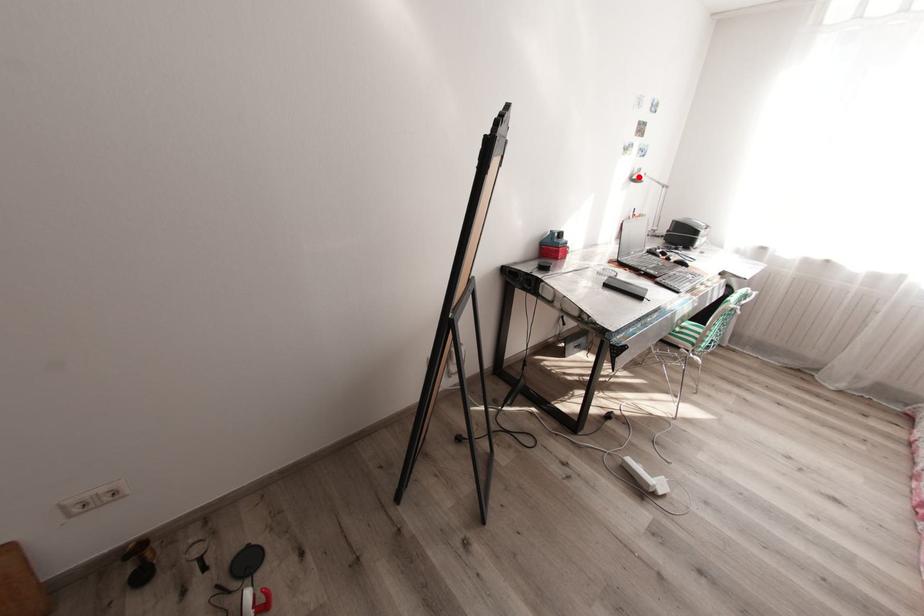
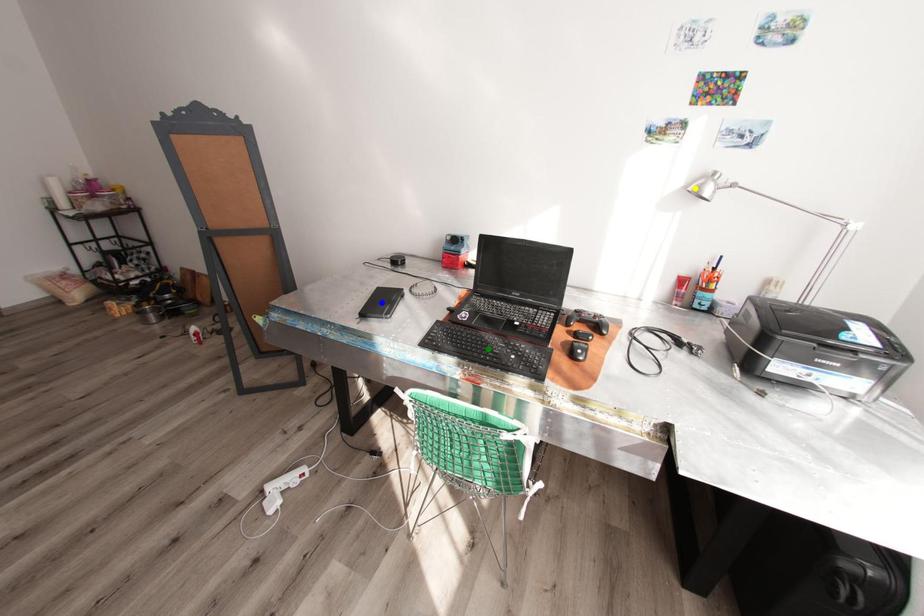
Question: I am providing you with two images of the same scene from different viewpoints. A red point is marked on the first image. You are given multiple points on the second image. Can you choose the point in image 2 that corresponds to the point in image 1?

Choices:
 (A) yellow point
 (B) green point
 (C) blue point

Answer: (A)